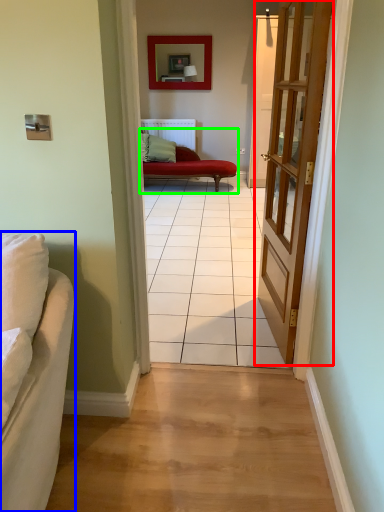
Question: Which object is positioned closest to door (highlighted by a red box)? Select from studio couch (highlighted by a blue box) and studio couch (highlighted by a green box).

Choices:
 (A) studio couch
 (B) studio couch

Answer: (A)